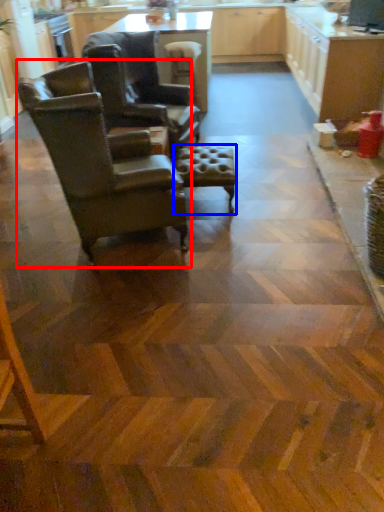
Question: Which object appears closest to the camera in this image, chair (highlighted by a red box) or bar stool (highlighted by a blue box)?

Choices:
 (A) chair
 (B) bar stool

Answer: (A)